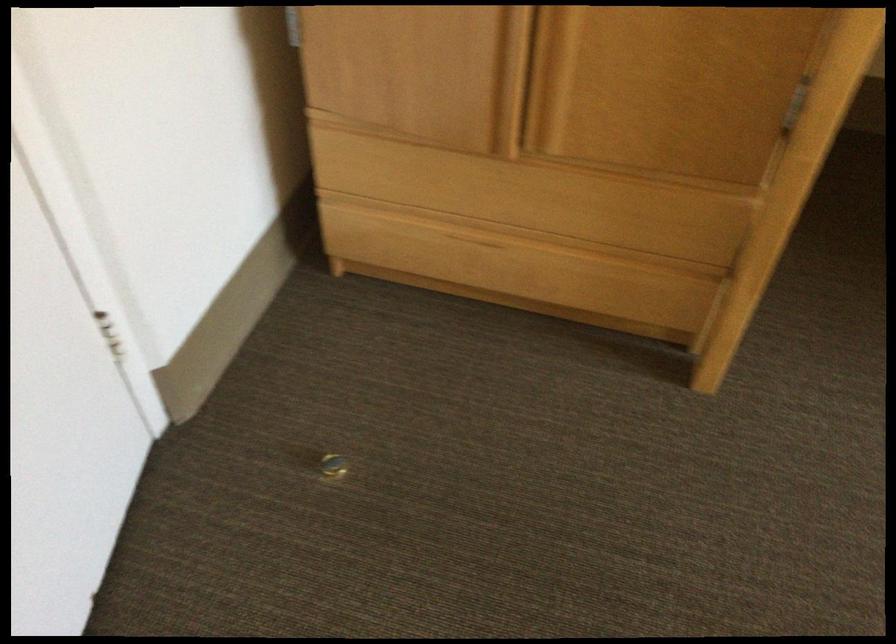
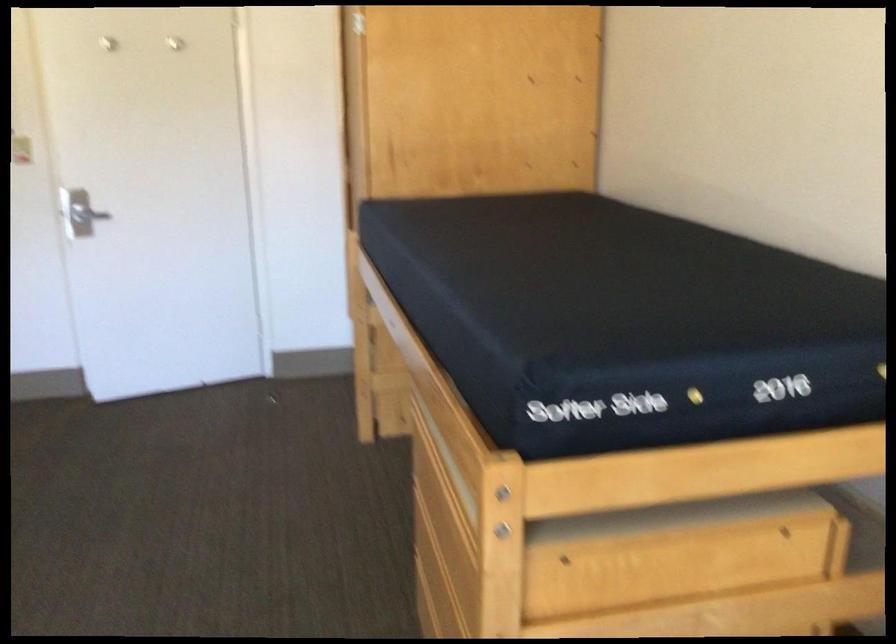
Question: I am providing you with two images of the same scene from different viewpoints. Which of the following objects are not visible in image2?

Choices:
 (A) bottom drawer handle
 (B) wooden drawer
 (C) orange chair lever
 (D) white coat hook

Answer: (A)